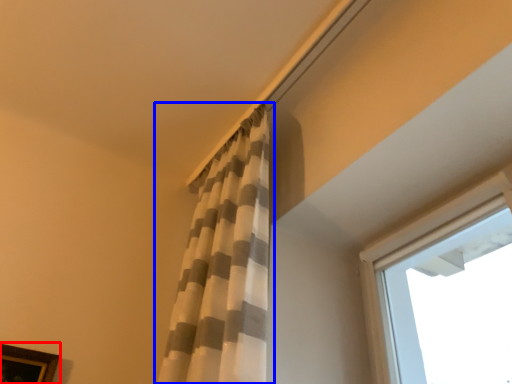
Question: Among these objects, which one is nearest to the camera, picture frame (highlighted by a red box) or curtain (highlighted by a blue box)?

Choices:
 (A) picture frame
 (B) curtain

Answer: (B)